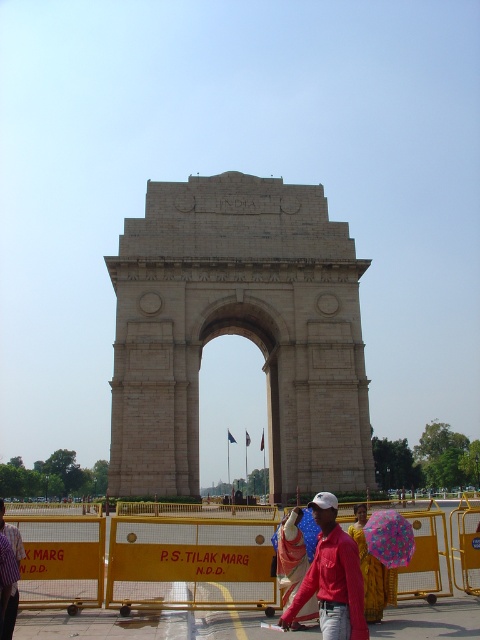
Question: Which point is closer to the camera?

Choices:
 (A) striped fabric shirt at lower left
 (B) multicolored fabric umbrella at center

Answer: (A)

Question: Does red cotton shirt at center appear on the left side of yellow fabric umbrella at lower right?

Choices:
 (A) yes
 (B) no

Answer: (A)

Question: Does beige stone arch at center lie in front of yellow fabric umbrella at lower right?

Choices:
 (A) yes
 (B) no

Answer: (B)

Question: Is yellow fabric umbrella at lower right further to the viewer compared to striped fabric shirt at lower left?

Choices:
 (A) yes
 (B) no

Answer: (B)

Question: Which of the following is the farthest from the observer?

Choices:
 (A) (294, 518)
 (B) (197, 262)
 (C) (389, 528)
 (D) (323, 557)

Answer: (B)

Question: Which object is farther from the camera taking this photo?

Choices:
 (A) beige stone arch at center
 (B) red cotton shirt at center
 (C) multicolored fabric umbrella at center

Answer: (A)